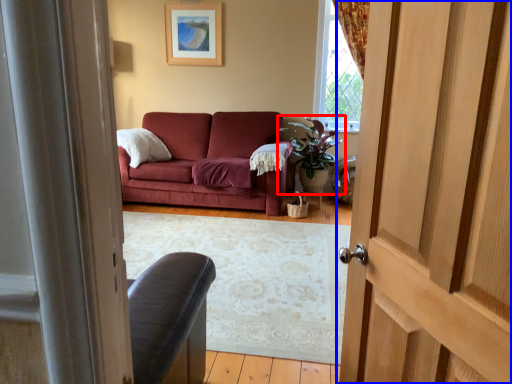
Question: Which point is further to the camera, houseplant (highlighted by a red box) or door (highlighted by a blue box)?

Choices:
 (A) houseplant
 (B) door

Answer: (A)